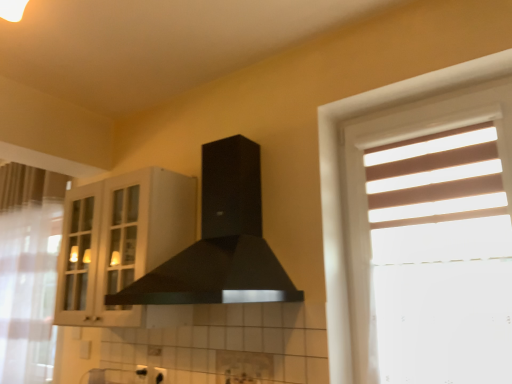
Question: From a real-world perspective, is clear glass screen door at left positioned under white glass cabinet at upper left based on gravity?

Choices:
 (A) yes
 (B) no

Answer: (B)

Question: Does clear glass screen door at left have a greater height compared to white glass cabinet at upper left?

Choices:
 (A) no
 (B) yes

Answer: (B)

Question: Would you say clear glass screen door at left is a long distance from white glass cabinet at upper left?

Choices:
 (A) yes
 (B) no

Answer: (B)

Question: Can we say clear glass screen door at left lies outside white glass cabinet at upper left?

Choices:
 (A) no
 (B) yes

Answer: (B)

Question: Can you confirm if clear glass screen door at left is wider than white glass cabinet at upper left?

Choices:
 (A) no
 (B) yes

Answer: (A)

Question: From their relative heights in the image, would you say black matte fume hood at center is taller or shorter than clear glass screen door at left?

Choices:
 (A) tall
 (B) short

Answer: (B)

Question: In the image, is black matte fume hood at center positioned in front of or behind clear glass screen door at left?

Choices:
 (A) behind
 (B) front

Answer: (B)

Question: Choose the correct answer: Is black matte fume hood at center inside clear glass screen door at left or outside it?

Choices:
 (A) outside
 (B) inside

Answer: (A)

Question: In the image, is black matte fume hood at center on the left side or the right side of clear glass screen door at left?

Choices:
 (A) right
 (B) left

Answer: (A)

Question: Would you say white glass cabinet at upper left is to the left or to the right of white sheer curtain at left in the picture?

Choices:
 (A) left
 (B) right

Answer: (B)

Question: From a real-world perspective, is white glass cabinet at upper left positioned above or below white sheer curtain at left?

Choices:
 (A) above
 (B) below

Answer: (A)

Question: Does point (59, 319) appear closer or farther from the camera than point (49, 258)?

Choices:
 (A) closer
 (B) farther

Answer: (A)

Question: Considering the positions of white glass cabinet at upper left and white sheer curtain at left in the image, is white glass cabinet at upper left taller or shorter than white sheer curtain at left?

Choices:
 (A) tall
 (B) short

Answer: (B)

Question: From the image's perspective, is clear glass screen door at left located above or below white sheer curtain at left?

Choices:
 (A) below
 (B) above

Answer: (B)

Question: In the image, is clear glass screen door at left positioned in front of or behind white sheer curtain at left?

Choices:
 (A) behind
 (B) front

Answer: (A)